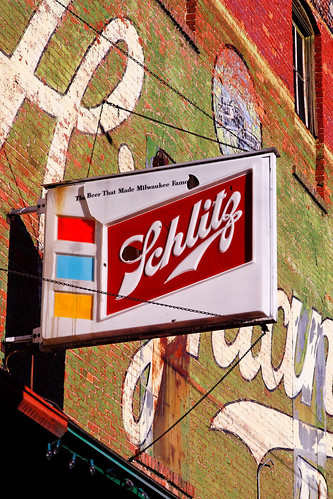
Locate an element on the screen. green string light wire is located at coordinates (98, 469).